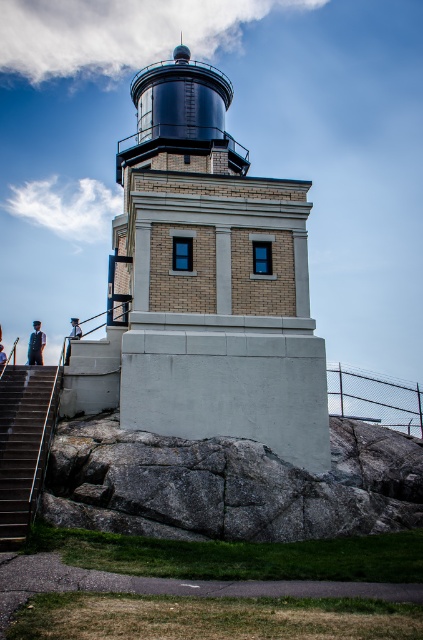
You are standing at the base of the lighthouse and notice a matte black graduation gown at lower left and a light brown wooden post at lower left. Which object is closer to the ground?

The matte black graduation gown at lower left is positioned under the light brown wooden post at lower left, so it is closer to the ground.

You are standing at the base of the lighthouse and want to determine which of the two points, point (x=33, y=333) or point (x=69, y=336), is closer to you. Based on the scene description, which point is nearer?

Point (x=33, y=333) is closer to the viewer than point (x=69, y=336).

You are standing at the base of the lighthouse and looking up towards the top. Which object is closer to you, the metallic gray stairs at lower left or the matte black person at upper left?

The metallic gray stairs at lower left are closer to you because they are in front of the matte black person at upper left.